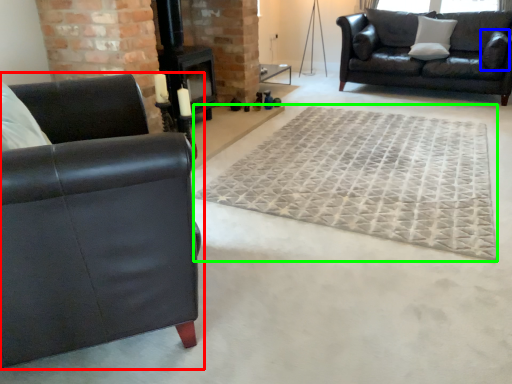
Question: Estimate the real-world distances between objects in this image. Which object is closer to studio couch (highlighted by a red box), pillow (highlighted by a blue box) or mat (highlighted by a green box)?

Choices:
 (A) pillow
 (B) mat

Answer: (B)